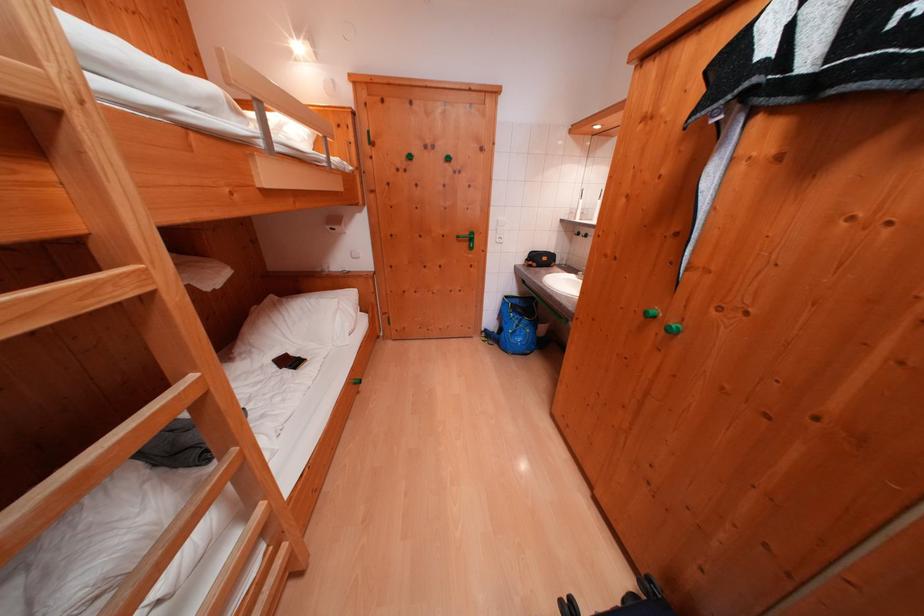
This screenshot has height=616, width=924. In order to click on green cabinet knob in this screenshot , I will do `click(673, 329)`.